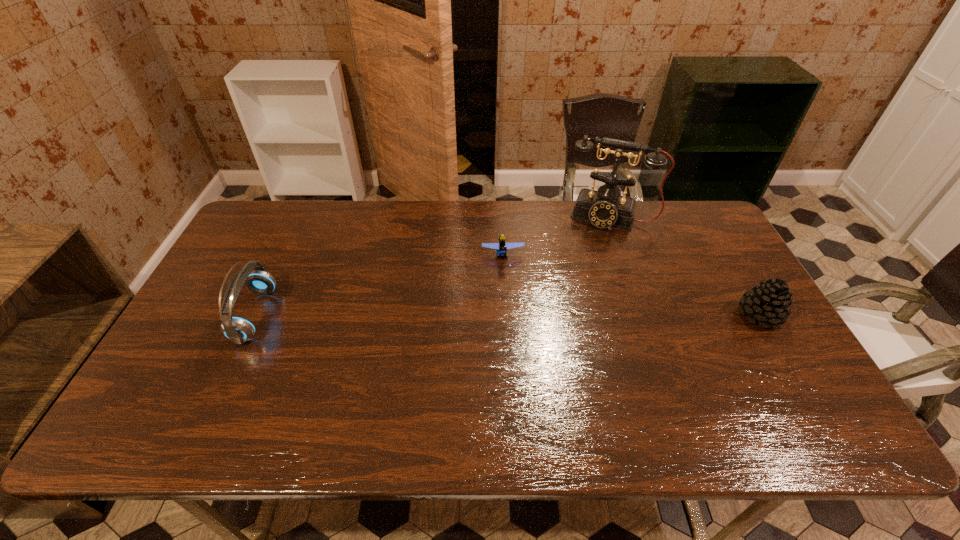
The image size is (960, 540). What are the coordinates of `free area in between the tallest object and the third object from right to left` in the screenshot? It's located at (556, 235).

Find the location of a particular element. The height and width of the screenshot is (540, 960). vacant area between the leftmost object and the pinecone is located at coordinates (508, 315).

This screenshot has height=540, width=960. Identify the location of free area in between the farthest object and the Lego. (556, 235).

Image resolution: width=960 pixels, height=540 pixels. Find the location of `vacant area that lies between the headset and the third object from left to right`. vacant area that lies between the headset and the third object from left to right is located at coordinates (432, 266).

The width and height of the screenshot is (960, 540). I want to click on vacant space that is in between the telephone and the third tallest object, so click(x=684, y=265).

Choose which object is the third nearest neighbor to the rightmost object. Please provide its 2D coordinates. Your answer should be formatted as a tuple, i.e. [(x, y)], where the tuple contains the x and y coordinates of a point satisfying the conditions above.

[(238, 329)]

Choose which object is the nearest neighbor to the Lego. Please provide its 2D coordinates. Your answer should be formatted as a tuple, i.e. [(x, y)], where the tuple contains the x and y coordinates of a point satisfying the conditions above.

[(604, 208)]

Find the location of a particular element. free point that satisfies the following two spatial constraints: 1. on the front side of the tallest object; 2. at the narrow end of the third tallest object is located at coordinates (643, 315).